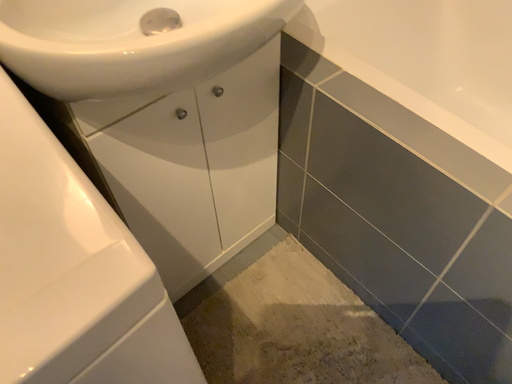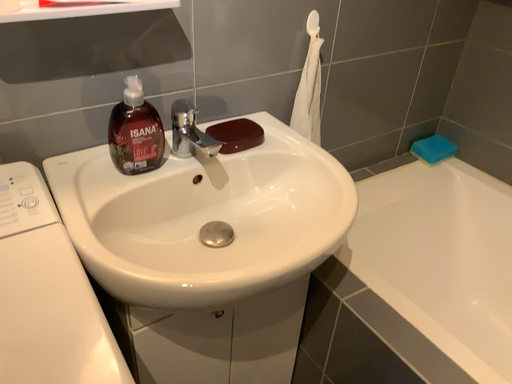
Question: Which way did the camera rotate in the video?

Choices:
 (A) rotated upward
 (B) rotated downward

Answer: (A)